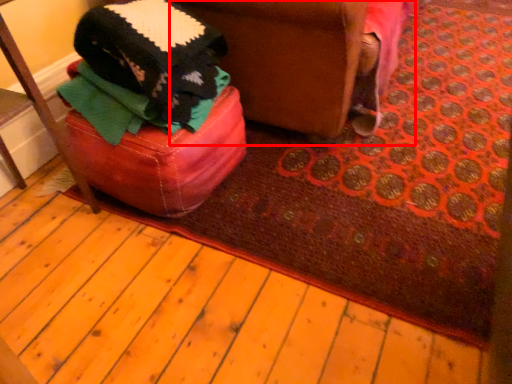
Question: Where is swivel chair (annotated by the red box) located in relation to furniture in the image?

Choices:
 (A) right
 (B) left

Answer: (A)